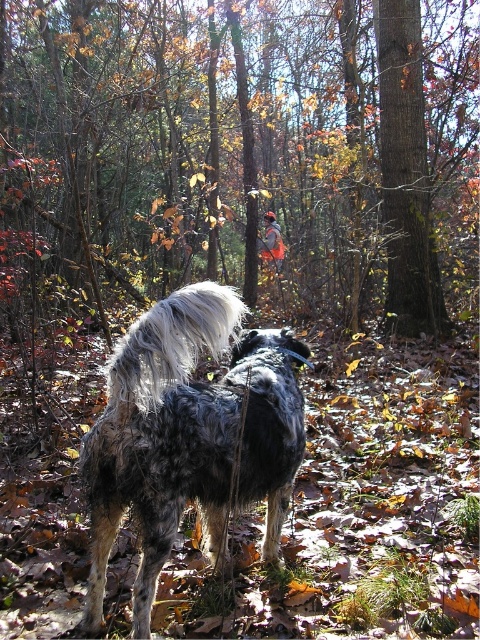
Does smooth bark tree at center have a lesser height compared to brown rough bark at center?

A: In fact, smooth bark tree at center may be taller than brown rough bark at center.

This screenshot has height=640, width=480. Describe the element at coordinates (240, 154) in the screenshot. I see `smooth bark tree at center` at that location.

This screenshot has width=480, height=640. What do you see at coordinates (240, 154) in the screenshot? I see `smooth bark tree at center` at bounding box center [240, 154].

Where is `smooth bark tree at center`? The height and width of the screenshot is (640, 480). smooth bark tree at center is located at coordinates (240, 154).

Who is more forward, (236,36) or (276,390)?

Positioned in front is point (276,390).

Is smooth bark tree at center taller than spotted fur dog at center?

Yes.

Does point (229, 152) come behind point (146, 387)?

Yes, it is behind point (146, 387).

This screenshot has height=640, width=480. I want to click on smooth bark tree at center, so click(240, 154).

Does spotted fur dog at center have a greater width compared to brown rough bark at center?

No, spotted fur dog at center is not wider than brown rough bark at center.

Is spotted fur dog at center smaller than brown rough bark at center?

Indeed, spotted fur dog at center has a smaller size compared to brown rough bark at center.

What do you see at coordinates (189, 435) in the screenshot? The image size is (480, 640). I see `spotted fur dog at center` at bounding box center [189, 435].

Where is `spotted fur dog at center`? The height and width of the screenshot is (640, 480). spotted fur dog at center is located at coordinates tap(189, 435).